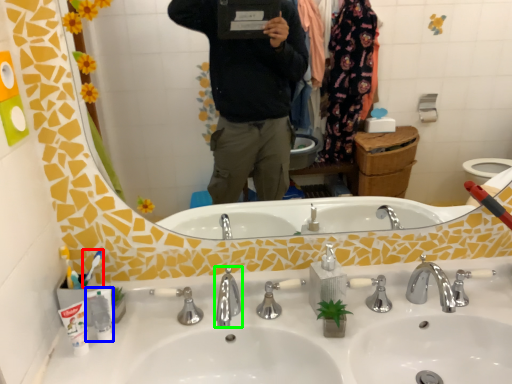
Question: Estimate the real-world distances between objects in this image. Which object is closer to toothbrush (highlighted by a red box), toiletry (highlighted by a blue box) or tap (highlighted by a green box)?

Choices:
 (A) toiletry
 (B) tap

Answer: (A)